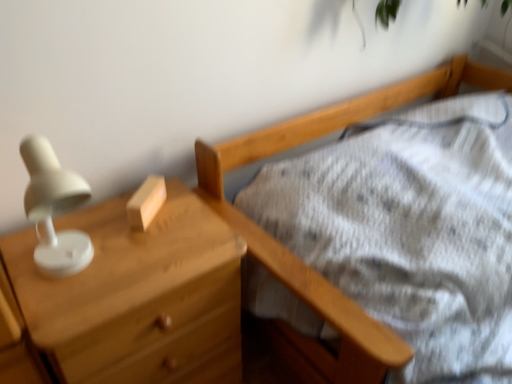
Question: Is matte wood chest of drawers at left wider or thinner than wooden block at center?

Choices:
 (A) wide
 (B) thin

Answer: (A)

Question: Is matte wood chest of drawers at left spatially inside wooden block at center, or outside of it?

Choices:
 (A) inside
 (B) outside

Answer: (B)

Question: Would you say matte wood chest of drawers at left is to the left or to the right of wooden block at center in the picture?

Choices:
 (A) left
 (B) right

Answer: (A)

Question: From a real-world perspective, is wooden block at center positioned above or below matte wood chest of drawers at left?

Choices:
 (A) above
 (B) below

Answer: (A)

Question: Is wooden block at center in front of or behind matte wood chest of drawers at left in the image?

Choices:
 (A) front
 (B) behind

Answer: (B)

Question: Does point [x=156, y=195] appear closer or farther from the camera than point [x=160, y=264]?

Choices:
 (A) closer
 (B) farther

Answer: (B)

Question: Is wooden block at center inside or outside of matte wood chest of drawers at left?

Choices:
 (A) inside
 (B) outside

Answer: (B)